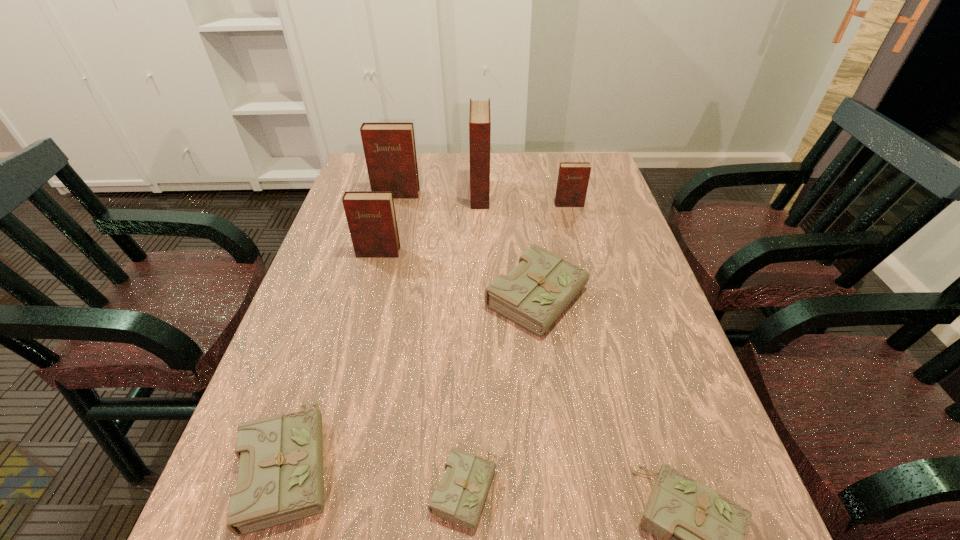
You are a GUI agent. You are given a task and a screenshot of the screen. Output one action in this format:
    pyautogui.click(x=<x>, y=<y>)
    Task: Click on the vacant area that lies between the leftmost green diary and the smallest green diary
    This screenshot has width=960, height=540.
    Given the screenshot: What is the action you would take?
    pyautogui.click(x=376, y=475)

Image resolution: width=960 pixels, height=540 pixels. I want to click on vacant area between the shortest object and the third shortest diary, so click(x=376, y=475).

This screenshot has height=540, width=960. Find the location of `free point between the tallest object and the third tallest diary`. free point between the tallest object and the third tallest diary is located at coordinates (429, 224).

This screenshot has height=540, width=960. In order to click on object identified as the sixth closest to the tallest object in this screenshot , I will do `click(460, 497)`.

Identify which object is the fourth closest to the sixth tallest diary. Please provide its 2D coordinates. Your answer should be formatted as a tuple, i.e. [(x, y)], where the tuple contains the x and y coordinates of a point satisfying the conditions above.

[(703, 534)]

The width and height of the screenshot is (960, 540). Identify the location of diary that can be found as the fifth closest to the fourth tallest diary. (460, 497).

Locate an element on the screen. diary that stands as the seventh closest to the shortest diary is located at coordinates (389, 148).

Identify which reddish-brown diary is the second nearest to the sixth shortest diary. Please provide its 2D coordinates. Your answer should be formatted as a tuple, i.e. [(x, y)], where the tuple contains the x and y coordinates of a point satisfying the conditions above.

[(479, 115)]

The image size is (960, 540). I want to click on reddish-brown diary that can be found as the third closest to the leftmost green diary, so click(389, 148).

The height and width of the screenshot is (540, 960). I want to click on the second closest green diary to the second shortest object, so click(x=533, y=294).